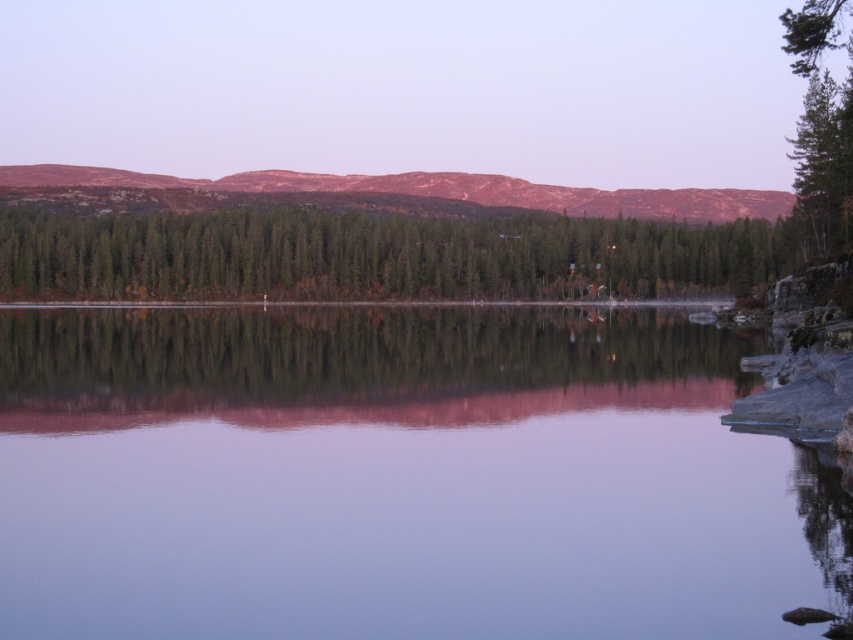
You are an artist trying to paint the landscape. You want to ensure that the transparent water at center and rustic brown mountain at upper center are proportionally accurate. Which object should you paint first to maintain the correct size relationship between them?

You should paint the rustic brown mountain at upper center first because it occupies more space than the transparent water at center, allowing you to establish the larger area before detailing the smaller one.

You are standing at the edge of the lake and see the transparent water at center and the green textured tree at right. Which object is closer to your left side?

The transparent water at center is positioned on the left side of green textured tree at right, so the transparent water at center is closer to your left side.

You are standing at the edge of the lake and want to determine the relative positions of two points marked in the image. Which point is closer to you, point (488,605) or point (306,180)?

Point (488,605) is closer to the viewer than point (306,180).